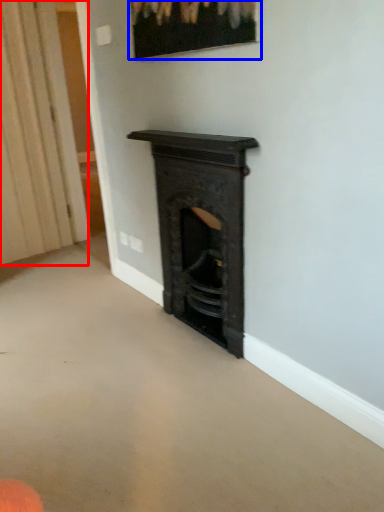
Question: Which of the following is the closest to the observer, curtain (highlighted by a red box) or picture frame (highlighted by a blue box)?

Choices:
 (A) curtain
 (B) picture frame

Answer: (B)